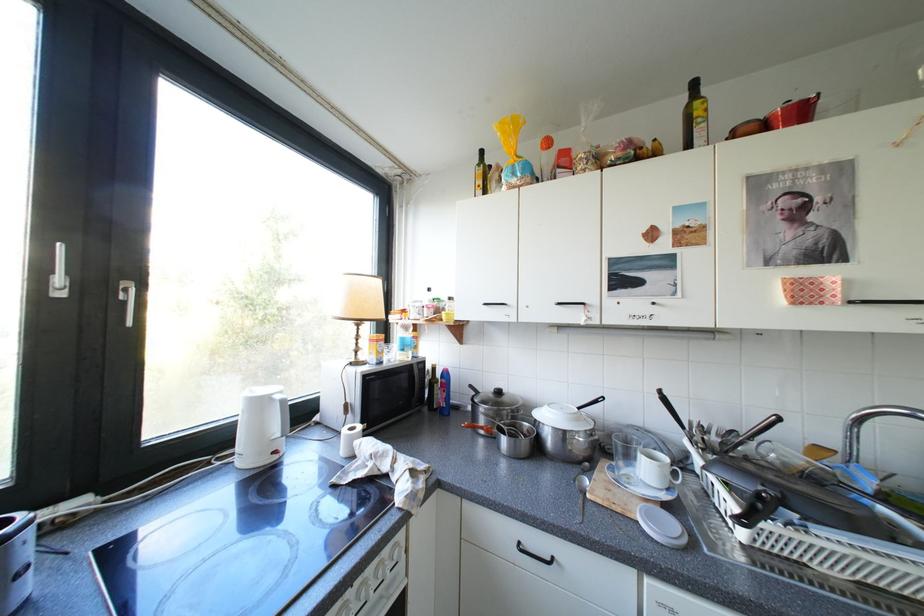
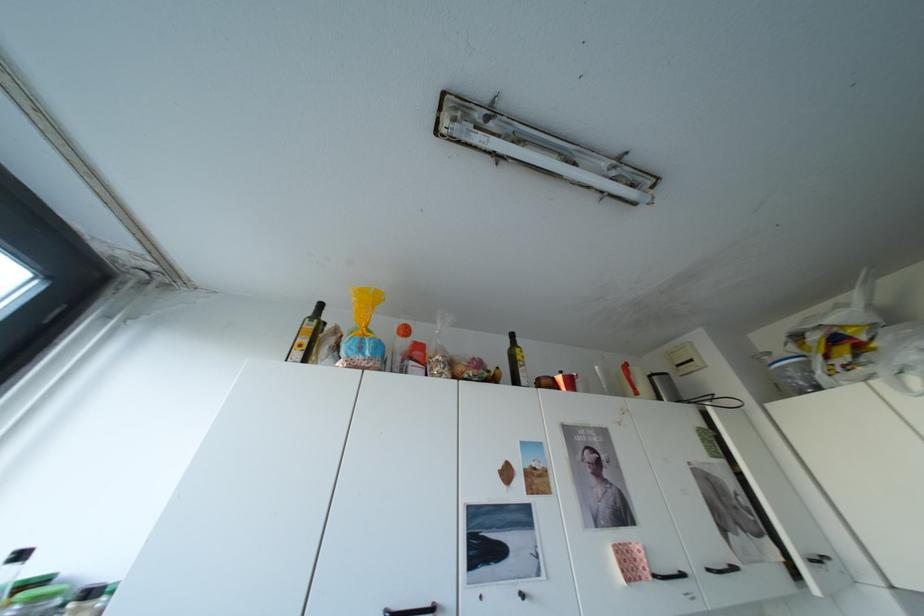
In the second image, find the point that corresponds to (816,294) in the first image.

(642, 568)